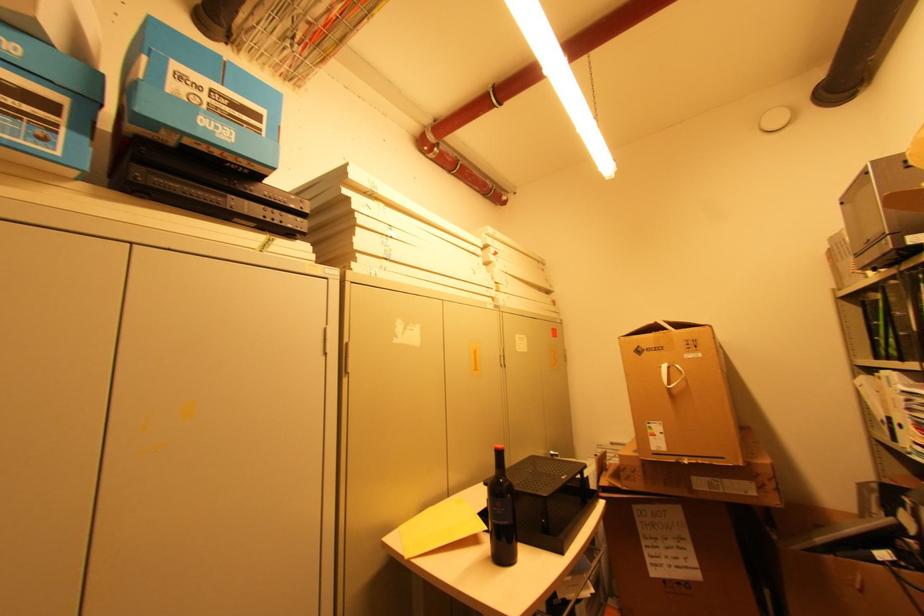
This screenshot has width=924, height=616. What are the coordinates of `white box handle` in the screenshot? It's located at (671, 376).